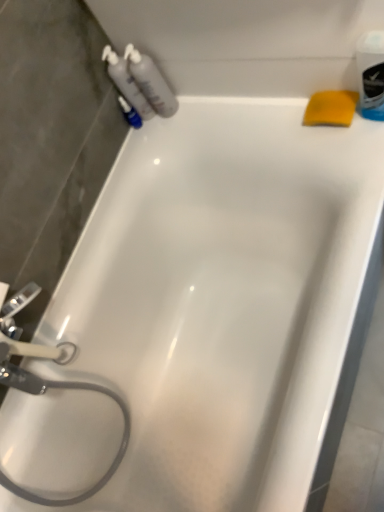
Find the location of a particular element. Image resolution: width=384 pixels, height=512 pixels. free location to the left of translucent plastic bottles at upper left, which is the 2th cleaning product in right-to-left order is located at coordinates (132, 153).